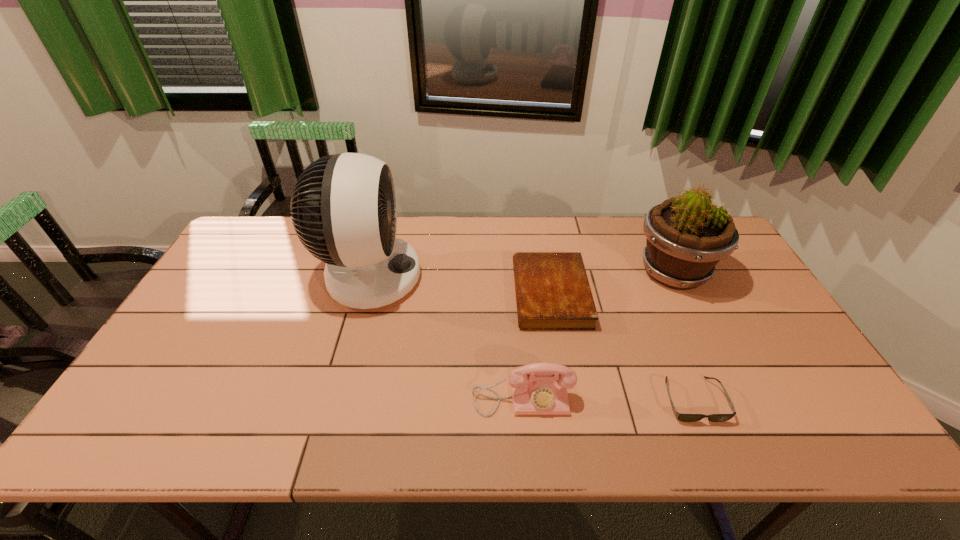
Locate an element on the screen. The height and width of the screenshot is (540, 960). vacant space that is in between the flowerpot and the fourth tallest object is located at coordinates (612, 284).

Identify which object is the closest to the sunglasses. Please provide its 2D coordinates. Your answer should be formatted as a tuple, i.e. [(x, y)], where the tuple contains the x and y coordinates of a point satisfying the conditions above.

[(552, 289)]

I want to click on the fourth closest object to the fan, so click(x=687, y=235).

Find the location of `free space that satisfies the following two spatial constraints: 1. on the front side of the flowerpot; 2. on the spine side of the Bible`. free space that satisfies the following two spatial constraints: 1. on the front side of the flowerpot; 2. on the spine side of the Bible is located at coordinates (685, 294).

Locate an element on the screen. This screenshot has height=540, width=960. free region that satisfies the following two spatial constraints: 1. on the front side of the flowerpot; 2. on the grille of the leftmost object is located at coordinates (677, 277).

The width and height of the screenshot is (960, 540). I want to click on vacant space that satisfies the following two spatial constraints: 1. on the front side of the flowerpot; 2. on the grille of the fan, so click(677, 277).